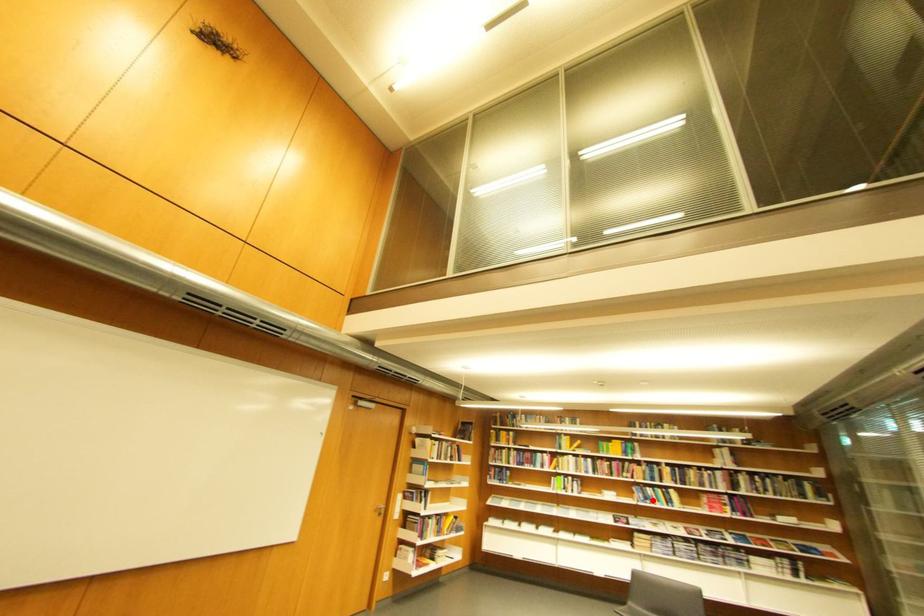
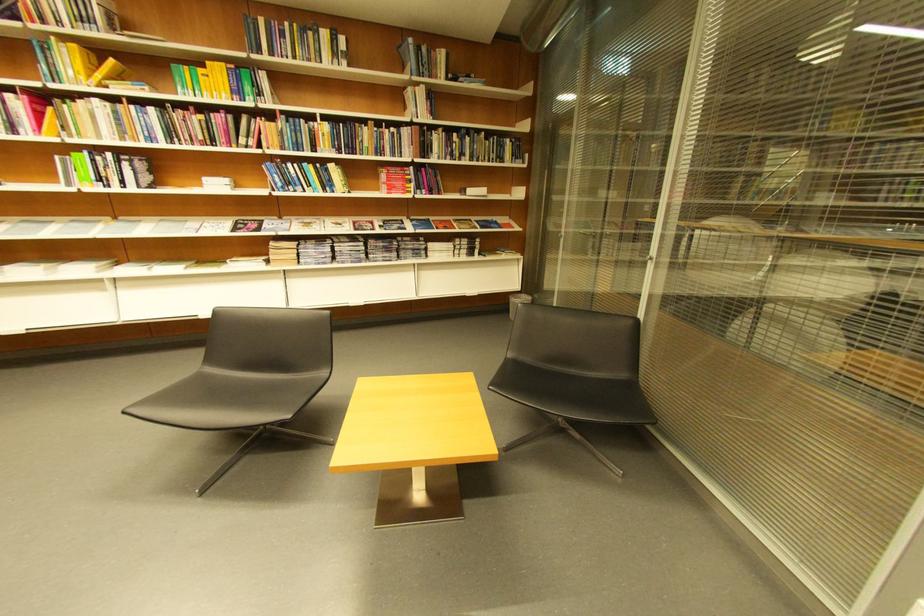
Question: A red point is marked in image1. In image2, is the corresponding 3D point closer to the camera or farther? Reply with the corresponding letter.

Choices:
 (A) The corresponding 3D point is closer.
 (B) The corresponding 3D point is farther.

Answer: (A)